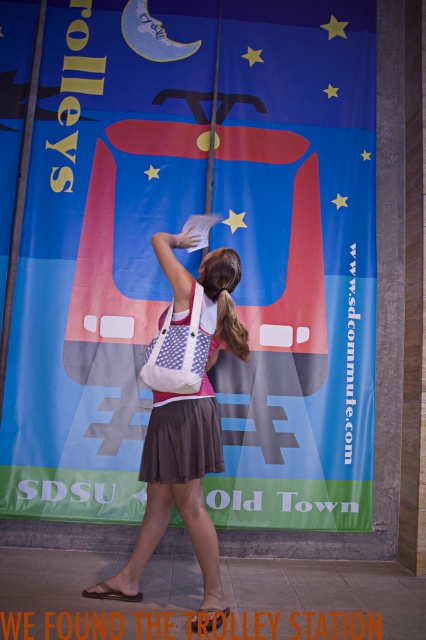
You are a fashion designer observing the scene. You notice the brown cotton dress at center and the brown silky hair at center. Which item is positioned lower on the person?

The brown cotton dress at center is positioned lower than the brown silky hair at center.

You are a photographer trying to capture the woman in the image without including the banner. The white canvas bag at center and brown cotton dress at center are in the way. Which object should you move to get a clear shot of her?

The white canvas bag at center is taller than the brown cotton dress at center, so you should move the white canvas bag at center to get a clear shot of her.

You are a photographer taking a picture of the matte red trolley at center and the brown silky hair at center. Which object should you focus on first if you want to ensure both are in sharp focus?

The matte red trolley at center is much taller than the brown silky hair at center, so you should focus on the taller matte red trolley at center first to ensure both are in sharp focus.